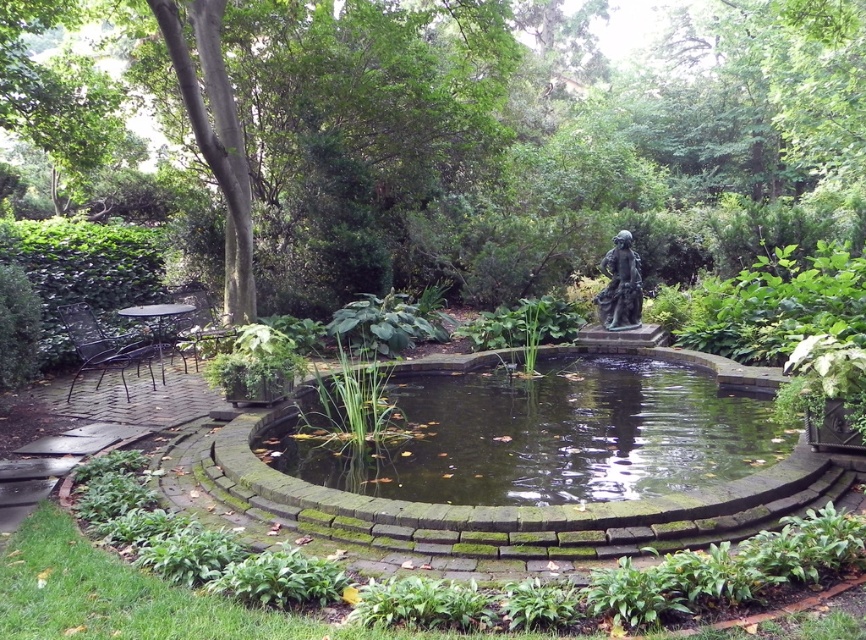
Question: Among these objects, which one is farthest from the camera?

Choices:
 (A) green mossy stone pond at center
 (B) green leafy tree at center
 (C) bronze statue at center

Answer: (C)

Question: Is green mossy stone pond at center above bronze statue at center?

Choices:
 (A) yes
 (B) no

Answer: (B)

Question: Estimate the real-world distances between objects in this image. Which object is farther from the green leafy tree at center?

Choices:
 (A) bronze statue at center
 (B) green mossy stone pond at center

Answer: (B)

Question: Is green mossy stone pond at center closer to the viewer compared to bronze statue at center?

Choices:
 (A) no
 (B) yes

Answer: (B)

Question: Does green mossy stone pond at center appear on the left side of bronze statue at center?

Choices:
 (A) no
 (B) yes

Answer: (B)

Question: Which of these objects is positioned farthest from the bronze statue at center?

Choices:
 (A) green mossy stone pond at center
 (B) green leafy tree at center

Answer: (B)